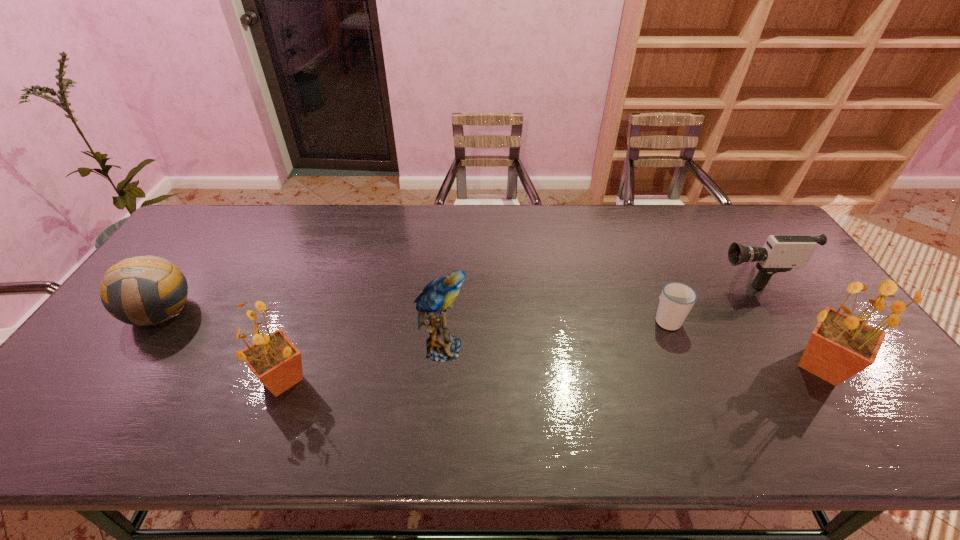
Where is `object that is at the left edge`? object that is at the left edge is located at coordinates (144, 290).

In order to click on sunflower positioned at the right edge in this screenshot , I will do `click(840, 346)`.

In order to click on camcorder situated at the right edge in this screenshot , I will do `click(780, 253)`.

I want to click on object that is positioned at the near right corner, so pyautogui.click(x=840, y=346).

Locate an element on the screen. This screenshot has height=540, width=960. vacant space at the far edge of the desktop is located at coordinates (500, 210).

Locate an element on the screen. Image resolution: width=960 pixels, height=540 pixels. free space at the near edge of the desktop is located at coordinates (391, 376).

In the image, there is a desktop. Identify the location of free region at the left edge. (135, 326).

The image size is (960, 540). I want to click on free space at the far left corner, so click(206, 226).

Locate an element on the screen. The image size is (960, 540). empty space that is in between the leftmost object and the taller sunflower is located at coordinates (491, 339).

Find the location of a particular element. free space between the camcorder and the third object from left to right is located at coordinates (596, 311).